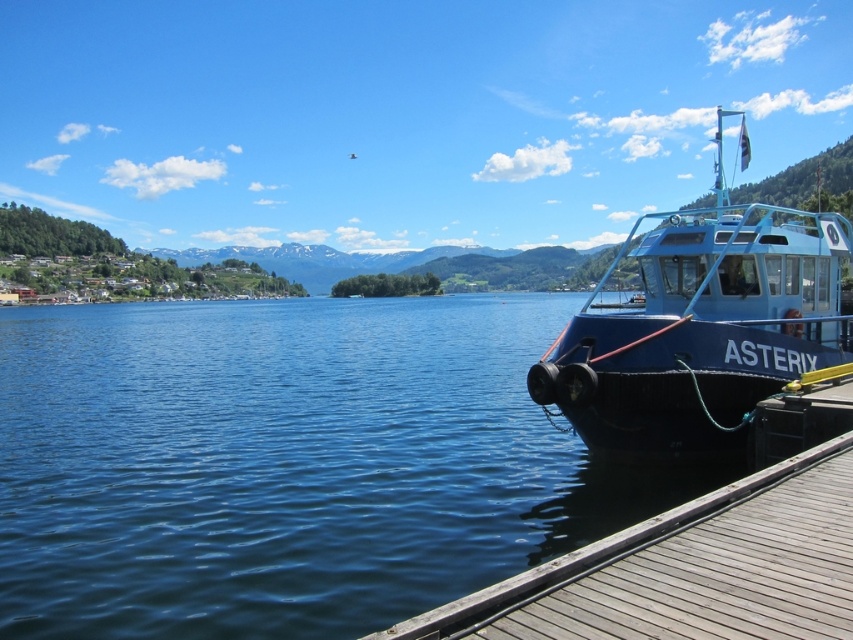
You are standing on the wooden dock and see the blue matte boat at right and the wooden at right. Which object is positioned further to the right?

The blue matte boat at right is positioned further to the right compared to the wooden at right, as it is located to the right of it.

You are a visitor standing on the lakeside dock and want to take a photo of the wooden at right without the blue matte boat at right blocking the view. Is this possible?

The wooden at right is behind the blue matte boat at right, so you can take a photo of the wooden at right without the blue matte boat at right blocking the view by positioning yourself so that the boat is in front of the wooden structure.

You are a visitor at the lakeside and want to take a photo of the blue matte boat at right and the wooden at right. Which object should you focus on first if you want to capture both in the same frame without moving the camera?

The blue matte boat at right is much taller than the wooden at right, so you should focus on the blue matte boat at right first to ensure both are in frame.